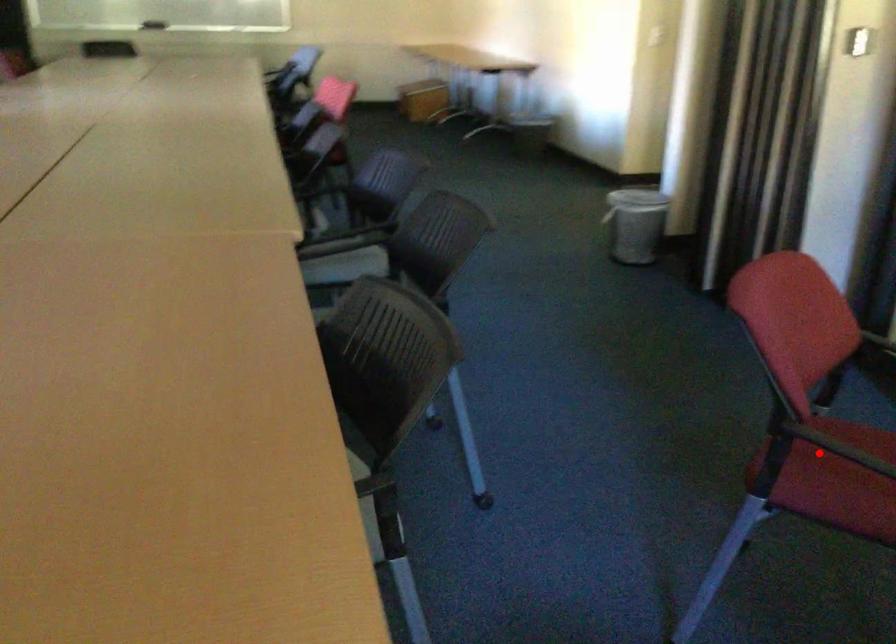
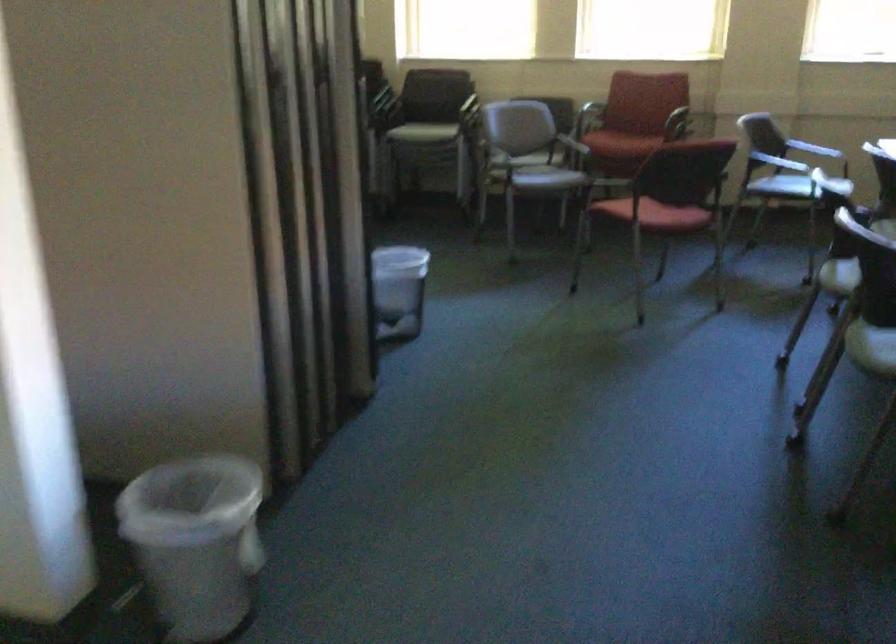
In the second image, find the point that corresponds to the highlighted location in the first image.

(660, 214)